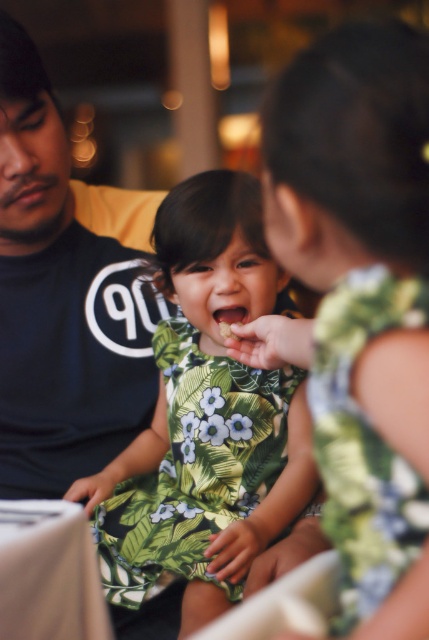
You are a photographer standing at a certain distance from the green leafy dress at center. If you want to capture a closeup shot of the dress, should you move closer or farther away?

The green leafy dress at center is 3.36 feet away from the camera. To capture a closeup shot, you should move closer to reduce the distance between the camera and the dress.

You are a photographer who needs to adjust the lighting to ensure both the green leafy dress at center and the black cotton shirt at left are well lit. Considering their heights, which one might require a closer light source to avoid shadows?

The green leafy dress at center has a lesser height compared to the black cotton shirt at left, so it might require a closer light source to avoid shadows.

You are a photographer who needs to adjust the lighting to ensure both the green leafy dress at center and the black cotton shirt at left are well lit. Considering their sizes, which item might require more focused lighting to highlight its details?

The green leafy dress at center has a larger size compared to the black cotton shirt at left, so it might require more focused lighting to highlight its details due to its bigger surface area.